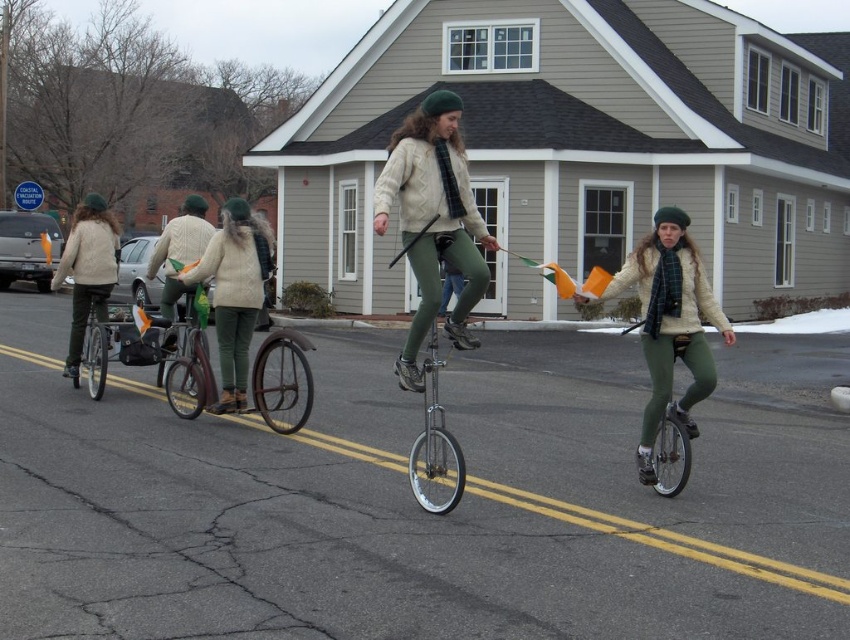
Question: Which point is farther to the camera?

Choices:
 (A) matte white jacket at center
 (B) brown leather bicycle at center
 (C) matte white sweater at left

Answer: (C)

Question: Is matte white jacket at center to the left of matte black bicycle at left from the viewer's perspective?

Choices:
 (A) no
 (B) yes

Answer: (A)

Question: Which point appears closest to the camera in this image?

Choices:
 (A) (378, 220)
 (B) (683, 333)
 (C) (230, 266)

Answer: (A)

Question: From the image, what is the correct spatial relationship of white knit sweater at center in relation to matte white sweater at left?

Choices:
 (A) right
 (B) left

Answer: (A)

Question: Is matte green unicycle at center to the left of matte white sweater at left from the viewer's perspective?

Choices:
 (A) no
 (B) yes

Answer: (A)

Question: Which of the following is the closest to the observer?

Choices:
 (A) (455, 499)
 (B) (80, 316)
 (C) (284, 340)

Answer: (A)